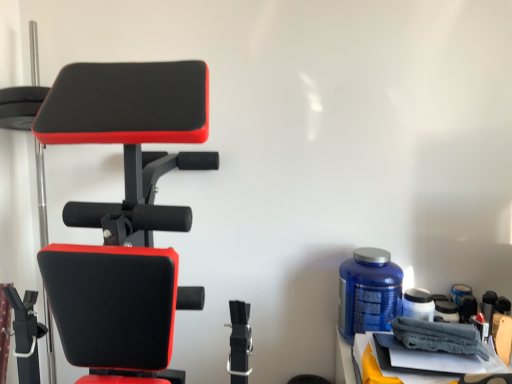
Question: Are gray fabric towel at lower right and blue plastic bottle at right making contact?

Choices:
 (A) no
 (B) yes

Answer: (A)

Question: Would you consider gray fabric towel at lower right to be distant from blue plastic bottle at right?

Choices:
 (A) yes
 (B) no

Answer: (B)

Question: Considering the relative sizes of gray fabric towel at lower right and blue plastic bottle at right in the image provided, is gray fabric towel at lower right shorter than blue plastic bottle at right?

Choices:
 (A) no
 (B) yes

Answer: (B)

Question: Can you confirm if gray fabric towel at lower right is thinner than blue plastic bottle at right?

Choices:
 (A) yes
 (B) no

Answer: (B)

Question: Can you confirm if gray fabric towel at lower right is wider than blue plastic bottle at right?

Choices:
 (A) yes
 (B) no

Answer: (A)

Question: Considering the relative positions of gray fabric towel at lower right and blue plastic bottle at right in the image provided, is gray fabric towel at lower right to the left of blue plastic bottle at right from the viewer's perspective?

Choices:
 (A) yes
 (B) no

Answer: (B)

Question: Can you confirm if matte black exercise bench at left is taller than blue plastic bottle at right?

Choices:
 (A) yes
 (B) no

Answer: (A)

Question: From a real-world perspective, is matte black exercise bench at left on top of blue plastic bottle at right?

Choices:
 (A) yes
 (B) no

Answer: (A)

Question: Considering the relative positions of matte black exercise bench at left and blue plastic bottle at right in the image provided, is matte black exercise bench at left to the left of blue plastic bottle at right from the viewer's perspective?

Choices:
 (A) yes
 (B) no

Answer: (A)

Question: From the image's perspective, is matte black exercise bench at left under blue plastic bottle at right?

Choices:
 (A) no
 (B) yes

Answer: (A)

Question: Is matte black exercise bench at left shorter than blue plastic bottle at right?

Choices:
 (A) yes
 (B) no

Answer: (B)

Question: Is the position of matte black exercise bench at left more distant than that of blue plastic bottle at right?

Choices:
 (A) yes
 (B) no

Answer: (B)

Question: Does blue plastic bottle at right have a smaller size compared to gray fabric towel at lower right?

Choices:
 (A) no
 (B) yes

Answer: (A)